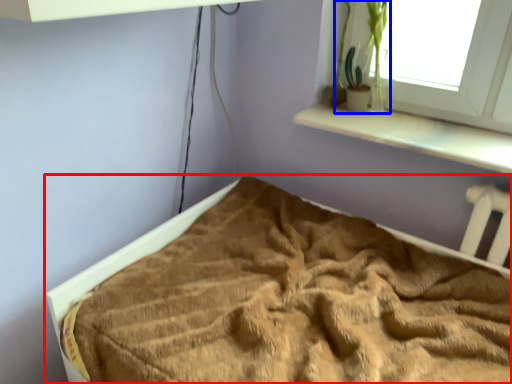
Question: Which of the following is the closest to the observer, bed (highlighted by a red box) or plant (highlighted by a blue box)?

Choices:
 (A) bed
 (B) plant

Answer: (A)